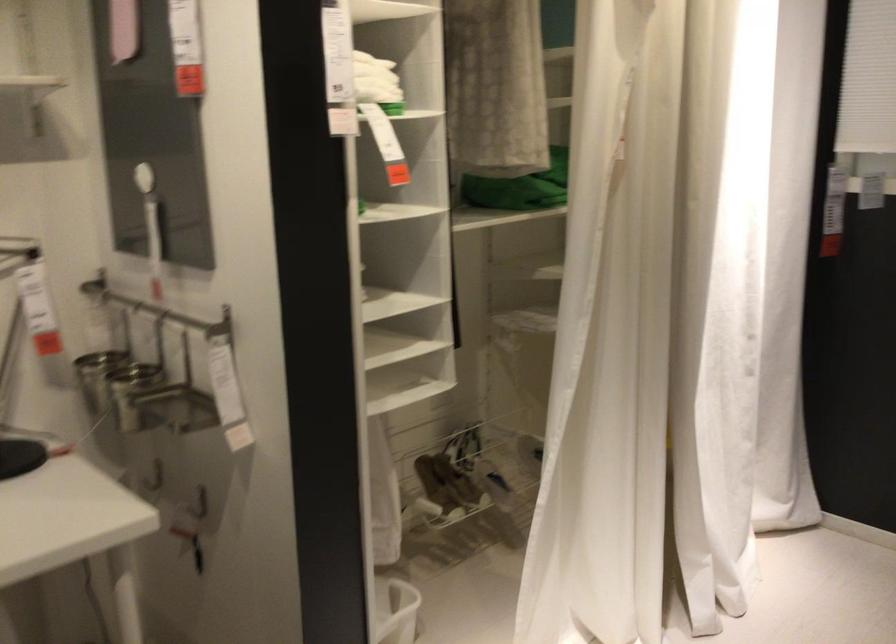
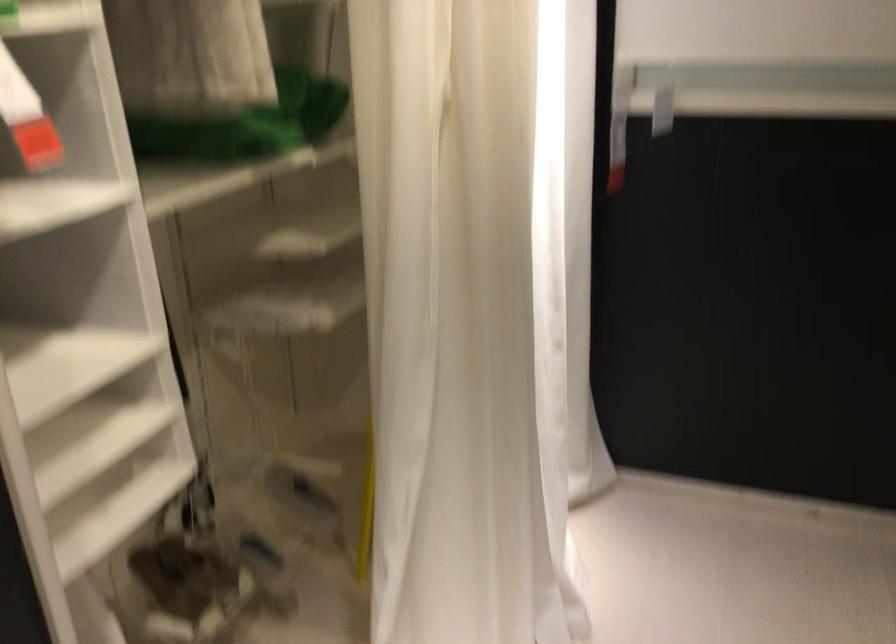
Question: What movement of the cameraman would produce the second image?

Choices:
 (A) Left
 (B) Right
 (C) Forward
 (D) Backward

Answer: (C)